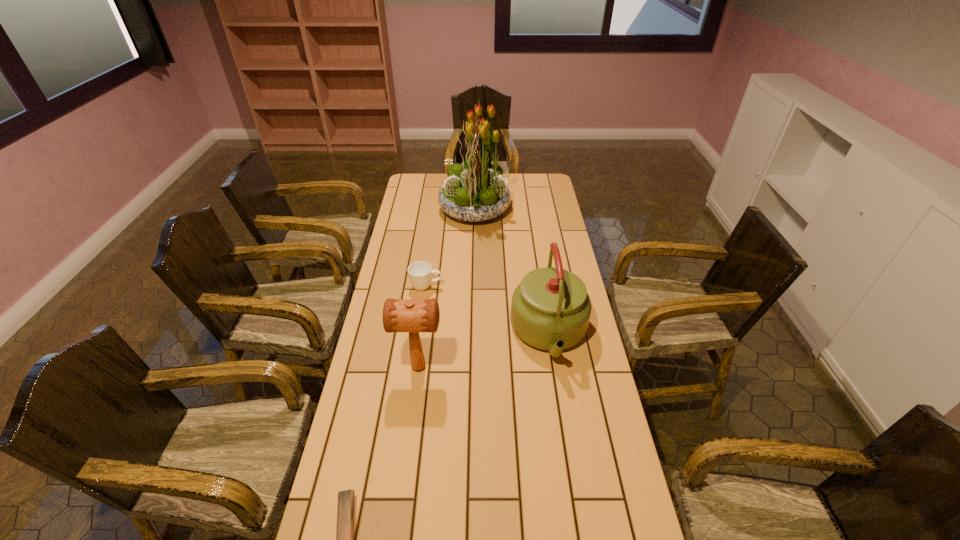
This screenshot has width=960, height=540. What are the coordinates of `object at the far edge` in the screenshot? It's located at (475, 191).

Locate an element on the screen. mallet present at the left edge is located at coordinates (399, 315).

You are a GUI agent. You are given a task and a screenshot of the screen. Output one action in this format:
    pyautogui.click(x=<x>, y=<y>)
    Task: Click on the cup that is at the left edge
    This screenshot has width=960, height=540.
    Given the screenshot: What is the action you would take?
    pyautogui.click(x=420, y=272)

Where is `object that is positioned at the right edge`? object that is positioned at the right edge is located at coordinates (550, 310).

In the image, there is a desktop. Where is `vacant space at the far edge`? The height and width of the screenshot is (540, 960). vacant space at the far edge is located at coordinates (441, 178).

You are a GUI agent. You are given a task and a screenshot of the screen. Output one action in this format:
    pyautogui.click(x=<x>, y=<y>)
    Task: Click on the vacant region at the left edge of the desktop
    
    Given the screenshot: What is the action you would take?
    pyautogui.click(x=367, y=490)

Identify the location of free location at the right edge of the desktop. Image resolution: width=960 pixels, height=540 pixels. (626, 537).

Identify the location of vacant space at the far right corner of the desktop. The height and width of the screenshot is (540, 960). (539, 176).

The width and height of the screenshot is (960, 540). Identify the location of free space between the taller mallet and the flower arrangement. (446, 288).

Identify the location of free spot between the fourth nearest object and the kettle. (488, 310).